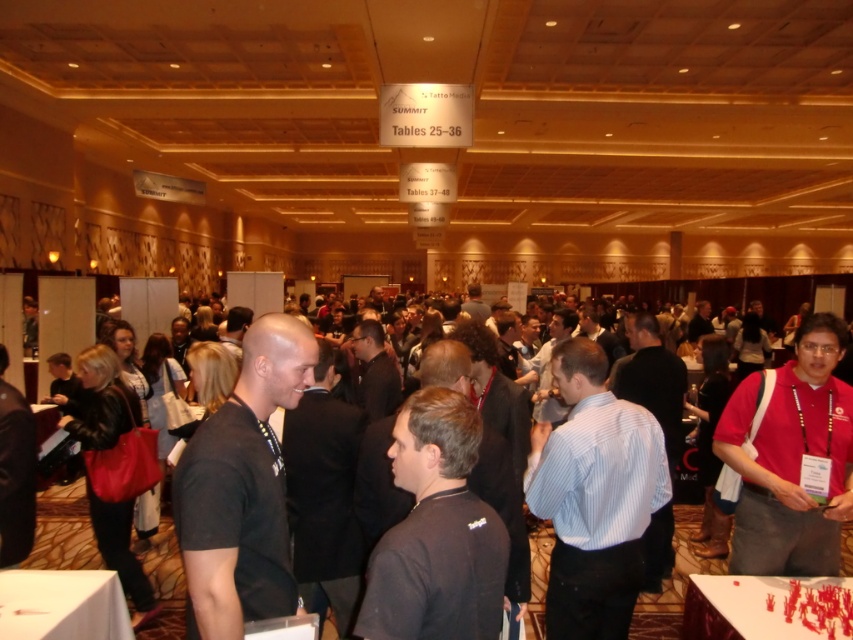
Question: Is blue striped shirt at center to the left of white paper table at center from the viewer's perspective?

Choices:
 (A) yes
 (B) no

Answer: (A)

Question: Which point is farther to the camera?

Choices:
 (A) white paper at lower left
 (B) blue striped shirt at center
 (C) matte red shirt at center
 (D) white paper table at center

Answer: (C)

Question: Can you confirm if blue striped shirt at center is smaller than matte red shirt at center?

Choices:
 (A) yes
 (B) no

Answer: (A)

Question: Where is white paper at lower left located in relation to white paper table at center in the image?

Choices:
 (A) below
 (B) above

Answer: (B)

Question: Which object is closer to the camera taking this photo?

Choices:
 (A) matte red shirt at center
 (B) blue striped shirt at center
 (C) white paper at lower left
 (D) white paper table at center

Answer: (D)

Question: Among these objects, which one is nearest to the camera?

Choices:
 (A) white paper at lower left
 (B) blue striped shirt at center
 (C) matte red shirt at center

Answer: (A)